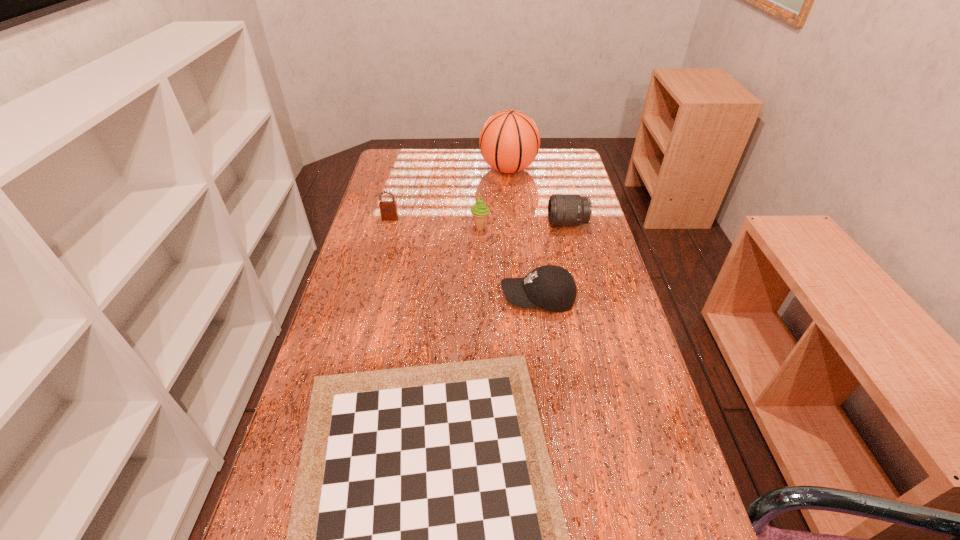
Locate an element on the screen. free space located 0.050m on the surface of the telephoto lens is located at coordinates (533, 224).

At what (x,y) coordinates should I click in order to perform the action: click on vacant space located 0.180m on the surface of the telephoto lens. Please return your answer as a coordinate pair (x, y). Image resolution: width=960 pixels, height=540 pixels. Looking at the image, I should click on pos(492,224).

Locate an element on the screen. free spot located on the front-facing side of the second nearest object is located at coordinates (452, 298).

Find the location of a particular element. The width and height of the screenshot is (960, 540). vacant space located on the front-facing side of the second nearest object is located at coordinates (478, 298).

Locate an element on the screen. The image size is (960, 540). free space located 0.280m on the front-facing side of the second nearest object is located at coordinates (396, 298).

This screenshot has height=540, width=960. I want to click on object located at the far edge, so click(x=509, y=141).

Locate an element on the screen. object positioned at the left edge is located at coordinates (388, 209).

Find the location of a particular element. The width and height of the screenshot is (960, 540). basketball present at the right edge is located at coordinates (509, 141).

Where is `telephoto lens that is at the right edge`? The width and height of the screenshot is (960, 540). telephoto lens that is at the right edge is located at coordinates (563, 209).

You are a GUI agent. You are given a task and a screenshot of the screen. Output one action in this format:
    pyautogui.click(x=<x>, y=<y>)
    Task: Click on the baseball cap situated at the right edge
    Image resolution: width=960 pixels, height=540 pixels.
    Given the screenshot: What is the action you would take?
    pyautogui.click(x=552, y=288)